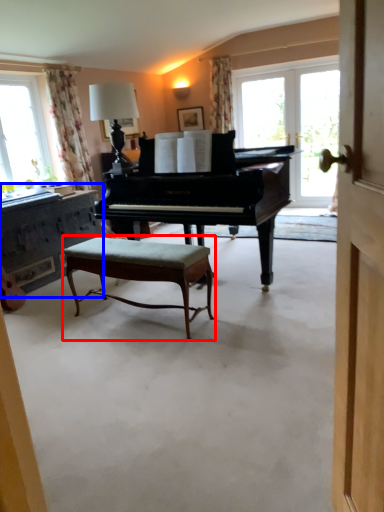
Question: Which of the following is the closest to the observer, stool (highlighted by a red box) or dresser (highlighted by a blue box)?

Choices:
 (A) stool
 (B) dresser

Answer: (A)